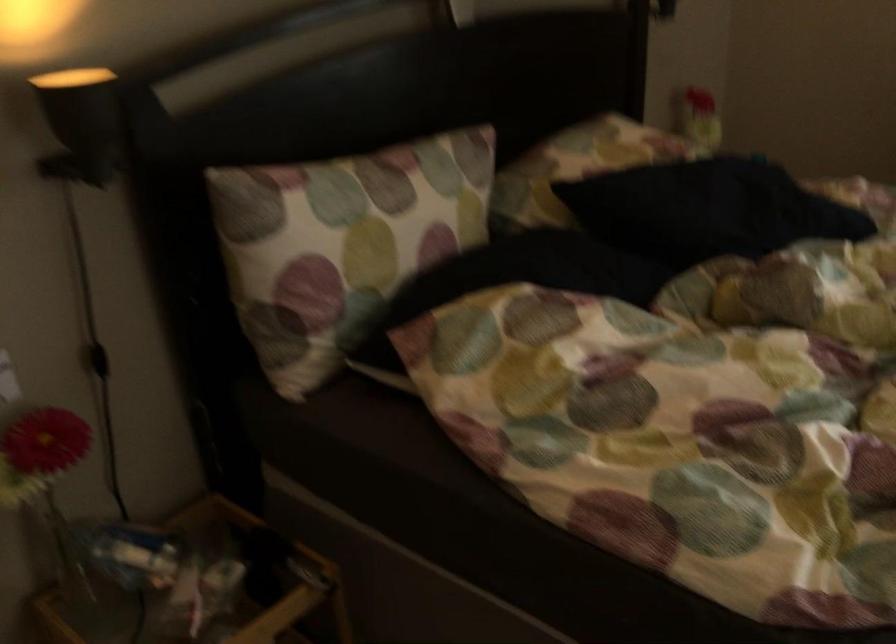
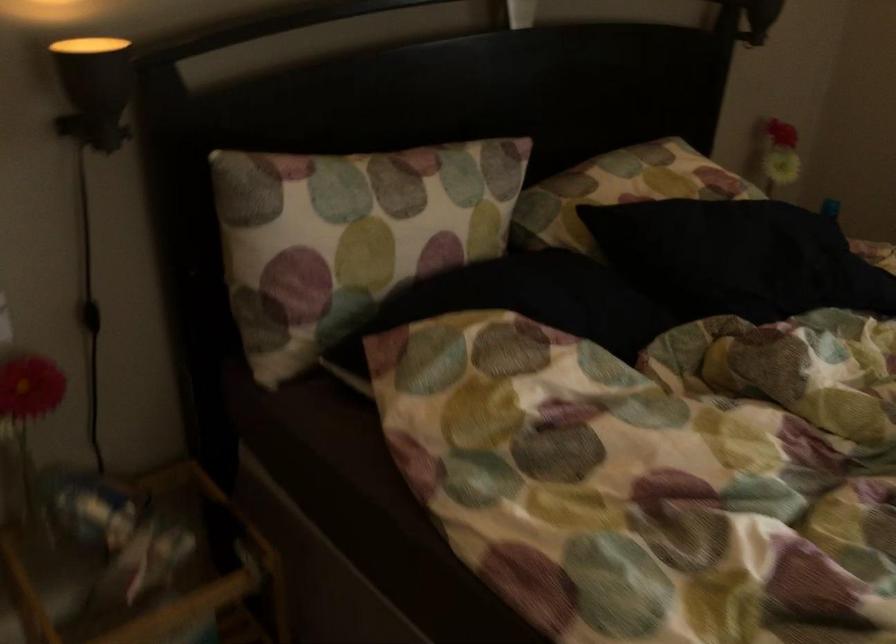
Locate, in the second image, the point that corresponds to point (713, 205) in the first image.

(737, 258)